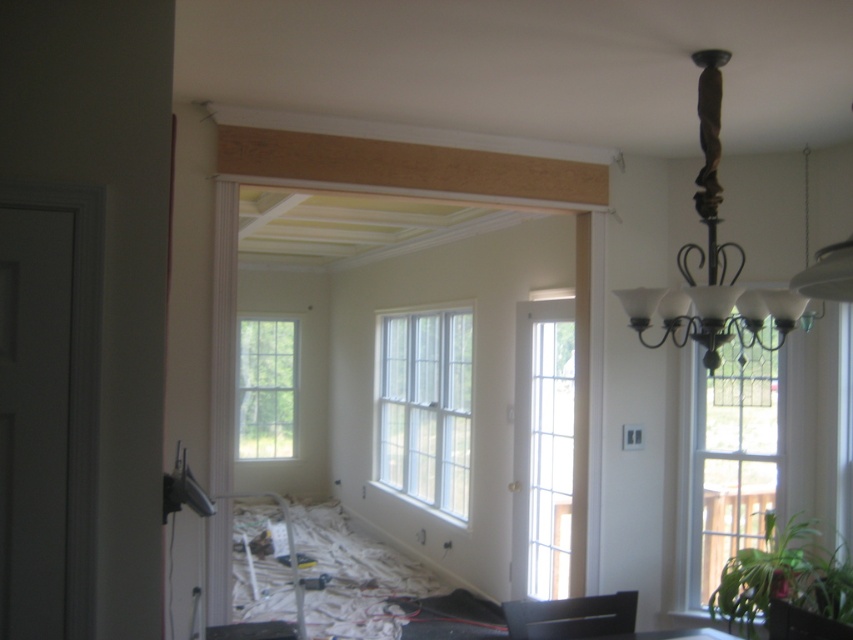
Which is below, clear glass window at right or black matte chair at lower center?

black matte chair at lower center is below.

Is clear glass window at right shorter than black matte chair at lower center?

No.

Does point (720, 348) come in front of point (518, 625)?

Yes.

Where is `clear glass window at right`? clear glass window at right is located at coordinates click(x=733, y=456).

Is clear glass window at center closer to the viewer compared to black plastic chair at lower right?

No, it is behind black plastic chair at lower right.

Is point (245, 387) farther from camera compared to point (813, 624)?

Yes, point (245, 387) is behind point (813, 624).

Where is `clear glass window at center`? The width and height of the screenshot is (853, 640). clear glass window at center is located at coordinates (265, 387).

The width and height of the screenshot is (853, 640). Describe the element at coordinates (426, 406) in the screenshot. I see `white glass window at center` at that location.

Who is higher up, white glass window at center or black matte chair at lower center?

white glass window at center is above.

Locate an element on the screen. The height and width of the screenshot is (640, 853). white glass window at center is located at coordinates (426, 406).